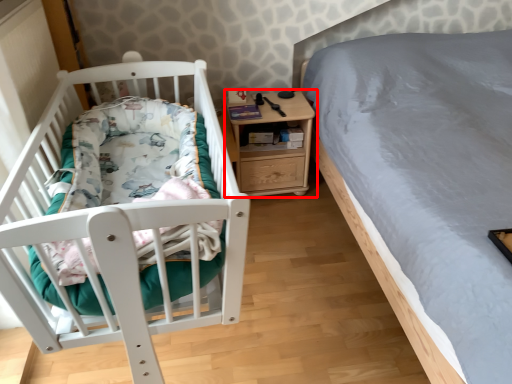
Question: From the image's perspective, where is nightstand (annotated by the red box) located relative to infant bed?

Choices:
 (A) below
 (B) above

Answer: (B)